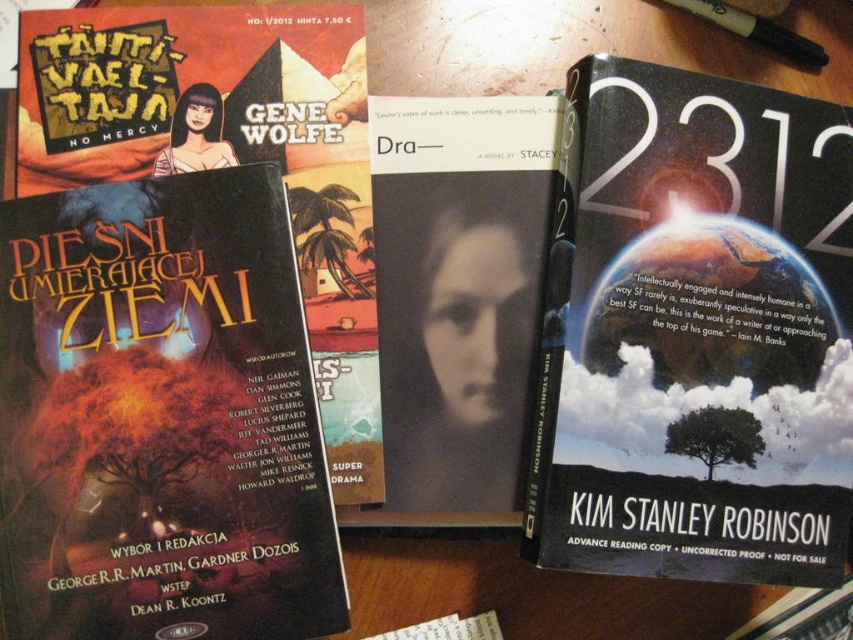
Question: Is hardcover book at right to the left of black matte book at center from the viewer's perspective?

Choices:
 (A) yes
 (B) no

Answer: (B)

Question: Does hardcover book at right have a greater width compared to dark matte book cover at left?

Choices:
 (A) yes
 (B) no

Answer: (A)

Question: Which point appears closest to the camera in this image?

Choices:
 (A) (138, 563)
 (B) (135, 32)
 (C) (740, 13)
 (D) (398, 316)

Answer: (A)

Question: Does matte black book at center appear on the left side of black plastic pen at upper right?

Choices:
 (A) no
 (B) yes

Answer: (B)

Question: Based on their relative distances, which object is farther from the dark matte book cover at left?

Choices:
 (A) hardcover book at right
 (B) matte black book at center
 (C) black matte book at center
 (D) black plastic pen at upper right

Answer: (D)

Question: Based on their relative distances, which object is farther from the hardcover book at right?

Choices:
 (A) dark matte book cover at left
 (B) matte black book at center
 (C) black plastic pen at upper right

Answer: (A)